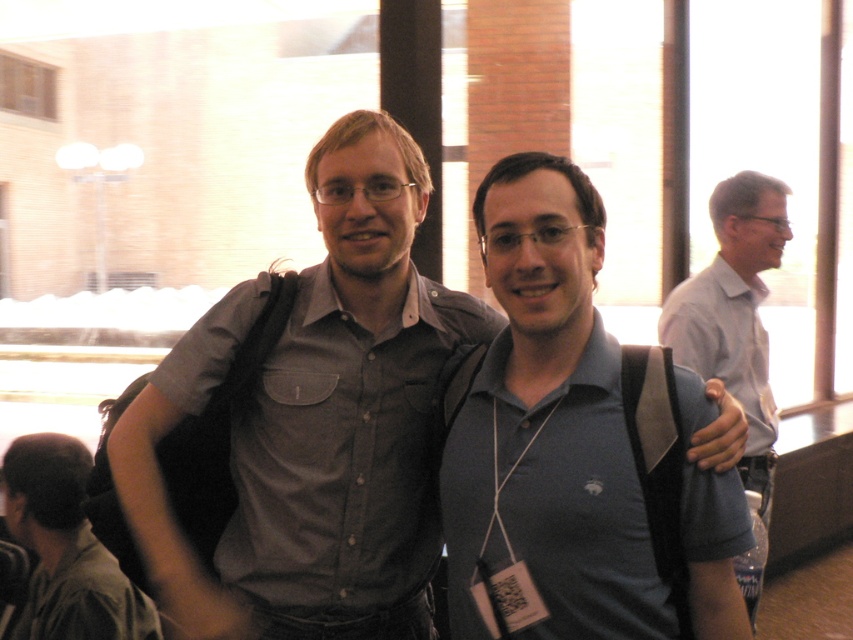
Between point (583, 625) and point (679, 323), which one is positioned behind?

Point (679, 323)

Does blue fabric shirt at center appear on the left side of gray shirt at right?

Correct, you'll find blue fabric shirt at center to the left of gray shirt at right.

Find the location of a particular element. The height and width of the screenshot is (640, 853). blue fabric shirt at center is located at coordinates (576, 448).

Is matte gray shirt at center to the right of blue fabric shirt at center from the viewer's perspective?

In fact, matte gray shirt at center is to the left of blue fabric shirt at center.

Between matte gray shirt at center and blue fabric shirt at center, which one appears on the right side from the viewer's perspective?

blue fabric shirt at center is more to the right.

Who is more forward, (x=357, y=349) or (x=514, y=292)?

Positioned in front is point (x=514, y=292).

At what (x,y) coordinates should I click in order to perform the action: click on matte gray shirt at center. Please return your answer as a coordinate pair (x, y). Looking at the image, I should click on (315, 420).

Does matte gray shirt at center have a greater height compared to dark gray shirt at lower left?

Correct, matte gray shirt at center is much taller as dark gray shirt at lower left.

Does matte gray shirt at center have a lesser height compared to dark gray shirt at lower left?

No, matte gray shirt at center is not shorter than dark gray shirt at lower left.

Who is more distant from viewer, (376, 419) or (22, 502)?

Point (22, 502)

Where is `matte gray shirt at center`? Image resolution: width=853 pixels, height=640 pixels. matte gray shirt at center is located at coordinates [x=315, y=420].